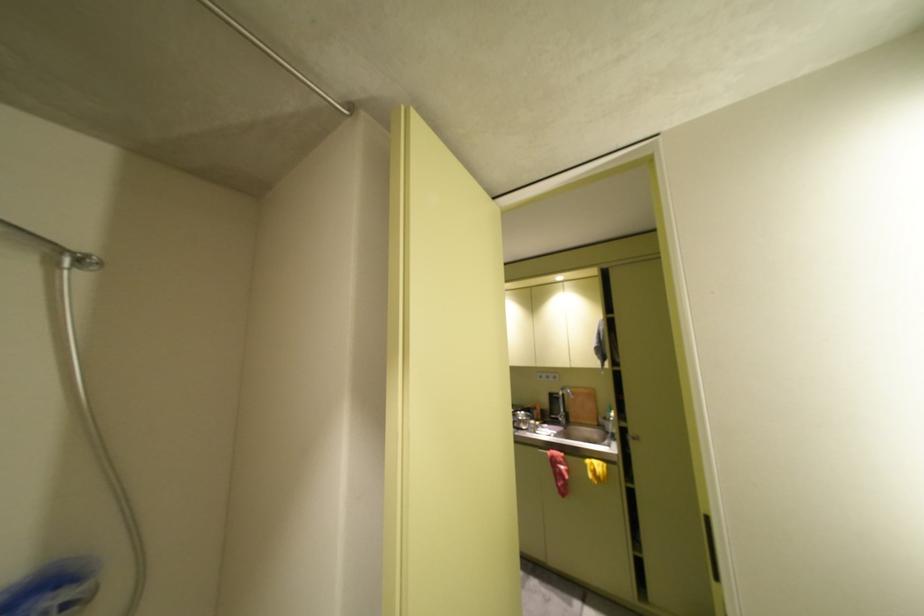
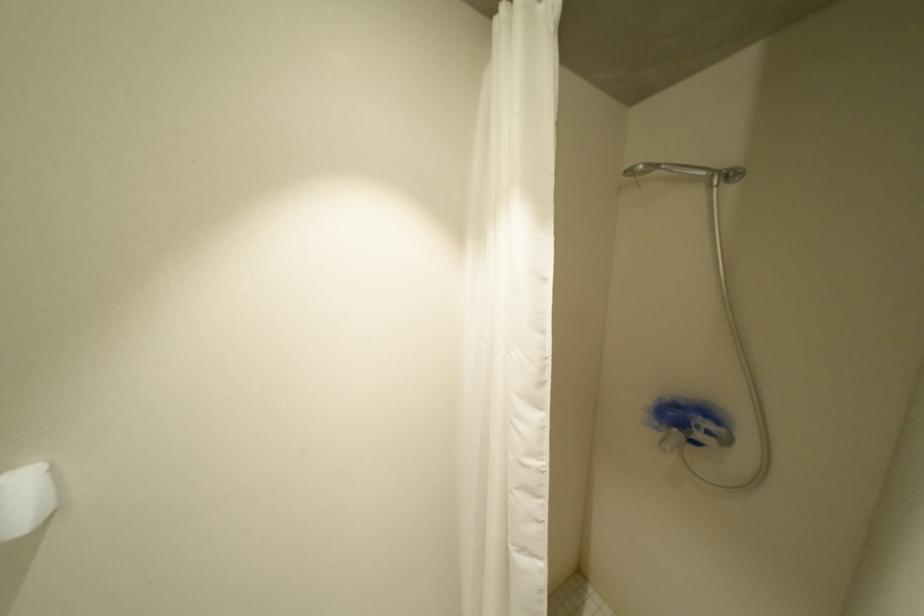
Where in the second image is the point corresponding to pixel 71 254 from the first image?

(723, 176)